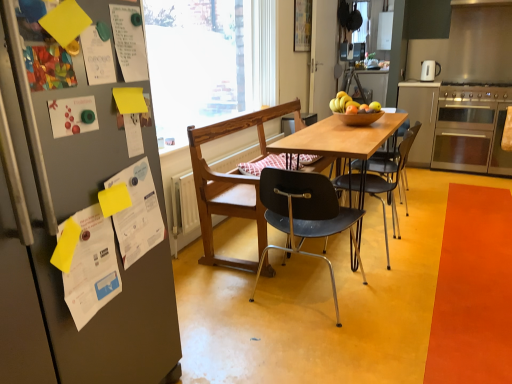
Question: Is black plastic chair at center, which appears as the 3th chair when viewed from the back, in front of multicolored paper at left, arranged as the first poster when viewed from the left?

Choices:
 (A) no
 (B) yes

Answer: (A)

Question: Can you confirm if black plastic chair at center, the first chair when ordered from front to back, is taller than multicolored paper at left, the 4th poster viewed from the top?

Choices:
 (A) no
 (B) yes

Answer: (B)

Question: From a real-world perspective, is black plastic chair at center, the first chair when ordered from front to back, located higher than multicolored paper at left, marked as the 7th poster in a right-to-left arrangement?

Choices:
 (A) no
 (B) yes

Answer: (A)

Question: Is black plastic chair at center, the first chair when ordered from front to back, aimed at multicolored paper at left, which ranks as the seventh poster in back-to-front order?

Choices:
 (A) no
 (B) yes

Answer: (A)

Question: Is black plastic chair at center, the first chair when ordered from front to back, shorter than multicolored paper at left, arranged as the first poster when viewed from the left?

Choices:
 (A) no
 (B) yes

Answer: (A)

Question: Is point (450, 215) closer or farther from the camera than point (360, 112)?

Choices:
 (A) closer
 (B) farther

Answer: (B)

Question: From the image's perspective, is orange matte mat at lower right located above or below shiny brown bowl at center?

Choices:
 (A) above
 (B) below

Answer: (B)

Question: Is orange matte mat at lower right wider or thinner than shiny brown bowl at center?

Choices:
 (A) thin
 (B) wide

Answer: (B)

Question: Choose the correct answer: Is orange matte mat at lower right inside shiny brown bowl at center or outside it?

Choices:
 (A) outside
 (B) inside

Answer: (A)

Question: Do you think white glossy electric kettle at upper right is within shiny brown bowl at center, or outside of it?

Choices:
 (A) inside
 (B) outside

Answer: (B)

Question: From a real-world perspective, is white glossy electric kettle at upper right physically located above or below shiny brown bowl at center?

Choices:
 (A) above
 (B) below

Answer: (A)

Question: Looking at the image, does white glossy electric kettle at upper right seem bigger or smaller compared to shiny brown bowl at center?

Choices:
 (A) big
 (B) small

Answer: (A)

Question: Visually, is white glossy electric kettle at upper right positioned to the left or to the right of shiny brown bowl at center?

Choices:
 (A) right
 (B) left

Answer: (A)

Question: Is white glossy electric kettle at upper right wider or thinner than transparent glass window at center?

Choices:
 (A) wide
 (B) thin

Answer: (B)

Question: Considering the relative positions of white glossy electric kettle at upper right and transparent glass window at center in the image provided, is white glossy electric kettle at upper right to the left or to the right of transparent glass window at center?

Choices:
 (A) left
 (B) right

Answer: (B)